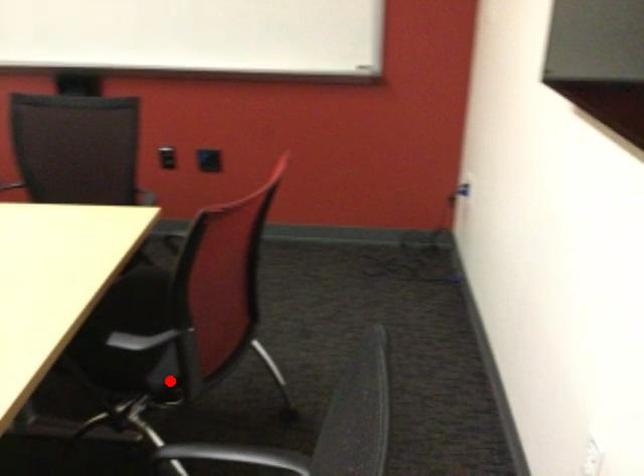
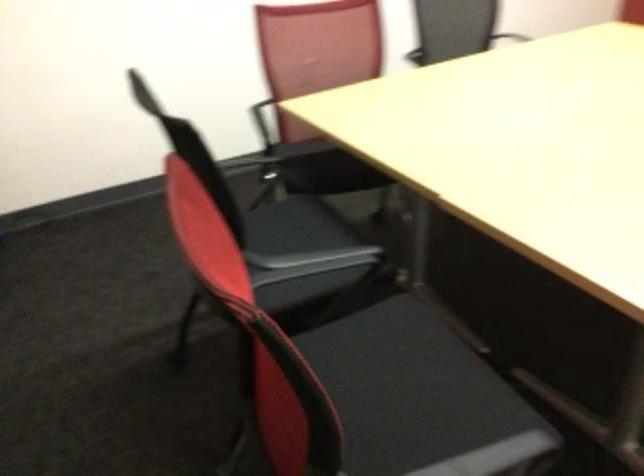
Question: I am providing you with two images of the same scene from different viewpoints. A red point is marked on the first image. Can you still see the location of the red point in image 2?

Choices:
 (A) Yes
 (B) No

Answer: (B)